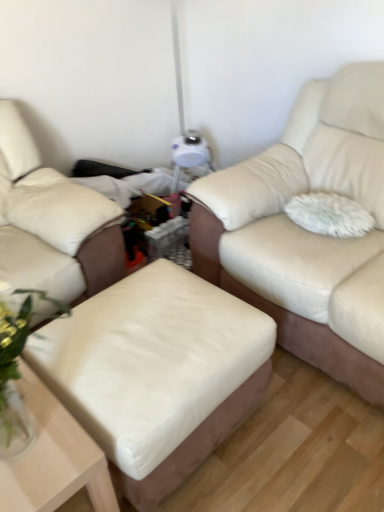
Question: In the image, is white fluffy pillow at right on the left side or the right side of beige leather ottoman at lower left, which is counted as the first studio couch, starting from the left?

Choices:
 (A) left
 (B) right

Answer: (B)

Question: Looking at their shapes, would you say white fluffy pillow at right is wider or thinner than beige leather ottoman at lower left, which appears as the 2th studio couch when viewed from the right?

Choices:
 (A) thin
 (B) wide

Answer: (A)

Question: Which object is positioned closest to the matte cream leather couch at center, marked as the 2th studio couch in a left-to-right arrangement?

Choices:
 (A) wooden cocktail table at center
 (B) white fluffy pillow at right
 (C) beige leather ottoman at lower left, which appears as the 2th studio couch when viewed from the right
 (D) white leather ottoman at center
 (E) white matte table at lower left

Answer: (B)

Question: Estimate the real-world distances between objects in this image. Which object is farther from the white leather ottoman at center?

Choices:
 (A) matte cream leather couch at center, which is counted as the 1th studio couch, starting from the right
 (B) white matte table at lower left
 (C) beige leather ottoman at lower left, which is counted as the first studio couch, starting from the left
 (D) white fluffy pillow at right
 (E) wooden cocktail table at center

Answer: (D)